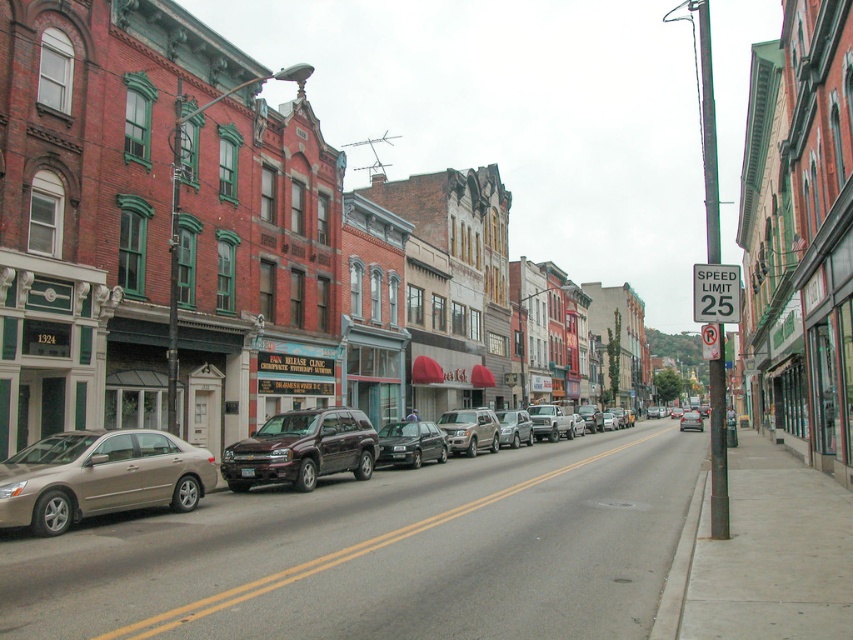
Consider the image. Is metallic silver car at center to the right of gold metallic sedan at lower left from the viewer's perspective?

Yes, metallic silver car at center is to the right of gold metallic sedan at lower left.

Does metallic silver car at center have a greater width compared to gold metallic sedan at lower left?

Yes.

Between point (506, 300) and point (39, 500), which one is positioned behind?

The point (506, 300) is behind.

Locate an element on the screen. The width and height of the screenshot is (853, 640). metallic silver car at center is located at coordinates (169, 234).

Is gold metallic sedan at left to the right of satin burgundy suv at center from the viewer's perspective?

No, gold metallic sedan at left is not to the right of satin burgundy suv at center.

Between gold metallic sedan at left and satin burgundy suv at center, which one is positioned lower?

satin burgundy suv at center

Which is in front, point (4, 500) or point (285, 481)?

Point (4, 500) is more forward.

You are a GUI agent. You are given a task and a screenshot of the screen. Output one action in this format:
    pyautogui.click(x=<x>, y=<y>)
    Task: Click on the gold metallic sedan at left
    The width and height of the screenshot is (853, 640).
    Given the screenshot: What is the action you would take?
    pyautogui.click(x=166, y=467)

Can you confirm if gold metallic sedan at lower left is wider than metallic silver sedan at center?

In fact, gold metallic sedan at lower left might be narrower than metallic silver sedan at center.

Who is shorter, gold metallic sedan at lower left or metallic silver sedan at center?

gold metallic sedan at lower left is shorter.

Which is in front, point (160, 470) or point (693, 428)?

Positioned in front is point (160, 470).

This screenshot has height=640, width=853. In order to click on gold metallic sedan at lower left in this screenshot , I will do `click(100, 477)`.